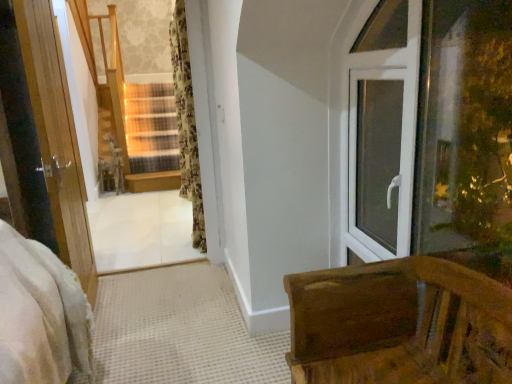
Identify the location of free spot to the left of floral fabric curtain at center. This screenshot has height=384, width=512. (162, 241).